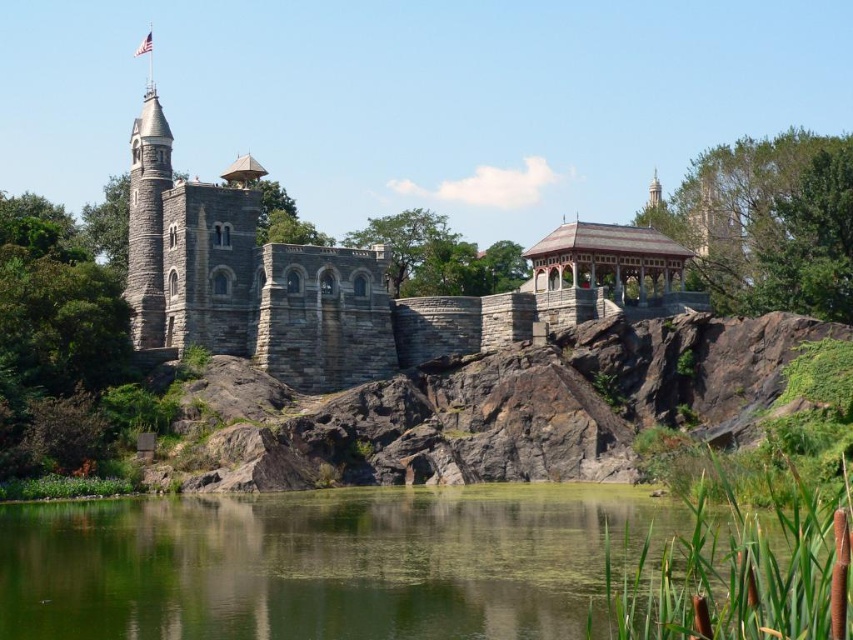
Is green liquid water at lower center behind gray stone tower at upper left?

No, green liquid water at lower center is closer to the viewer.

Can you confirm if green liquid water at lower center is taller than gray stone tower at upper left?

No, green liquid water at lower center is not taller than gray stone tower at upper left.

Where is `green liquid water at lower center`? green liquid water at lower center is located at coordinates (326, 563).